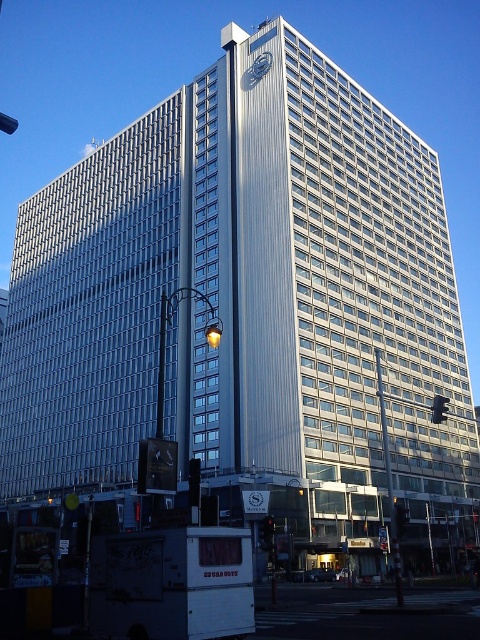
Question: Which object appears closest to the camera in this image?

Choices:
 (A) metallic clock at upper center
 (B) metallic pole at center-right

Answer: (B)

Question: Does metallic pole at center-right appear under metallic clock at upper center?

Choices:
 (A) no
 (B) yes

Answer: (B)

Question: Which point appears farthest from the camera in this image?

Choices:
 (A) pos(266,67)
 (B) pos(399,563)

Answer: (A)

Question: Is metallic pole at center-right closer to the viewer compared to metallic clock at upper center?

Choices:
 (A) yes
 (B) no

Answer: (A)

Question: Is metallic pole at center-right below metallic clock at upper center?

Choices:
 (A) yes
 (B) no

Answer: (A)